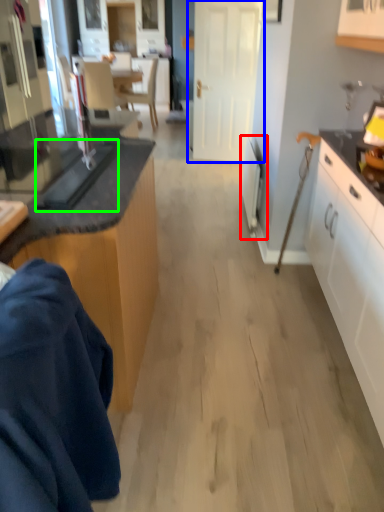
Question: Considering the real-world distances, which object is closest to appliance (highlighted by a red box)? door (highlighted by a blue box) or appliance (highlighted by a green box).

Choices:
 (A) door
 (B) appliance

Answer: (B)